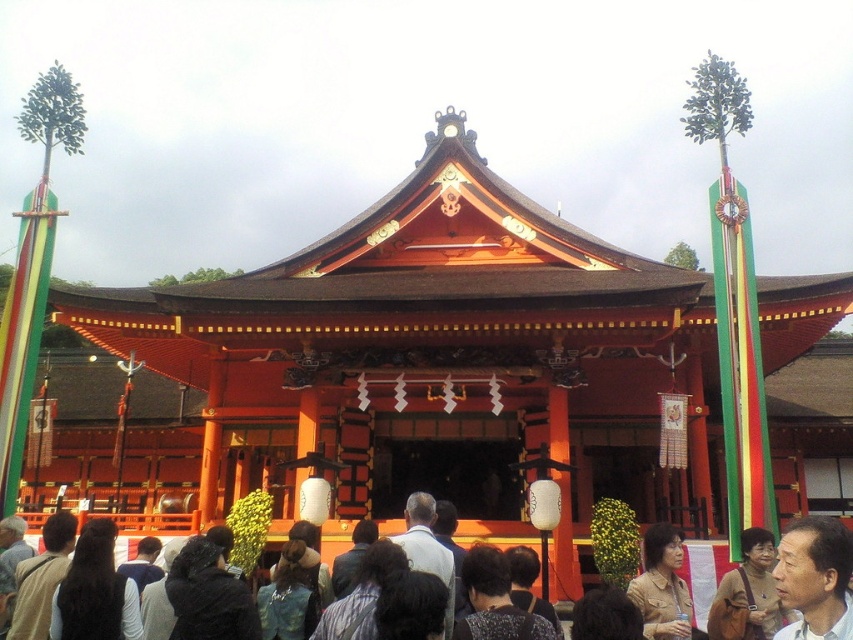
You are standing in front of the shrine and want to take a photo of the smooth skin face at center and the tan leather jacket at lower right. Which object should you zoom in more on to capture both clearly in the frame?

You should zoom in more on the tan leather jacket at lower right because the smooth skin face at center is smaller in size, so adjusting focus to accommodate the larger object ensures both fit clearly.

You are standing at the entrance of the shrine and want to take a photo of both the point at coordinates point (x=793, y=540) and the point at coordinates point (x=643, y=627). Based on their positions, which point should you focus on first to ensure both are in the frame?

Point (x=793, y=540) is in front of point (x=643, y=627), so you should focus on point (x=793, y=540) first to ensure both are in the frame.

You are standing in front of the shrine and want to take a photo of the smooth skin face at center without the tan leather jacket at lower right appearing in the background. Is this possible based on their positions?

The smooth skin face at center is in front of the tan leather jacket at lower right, so yes, you can take a photo of the smooth skin face at center without the tan leather jacket at lower right showing in the background.